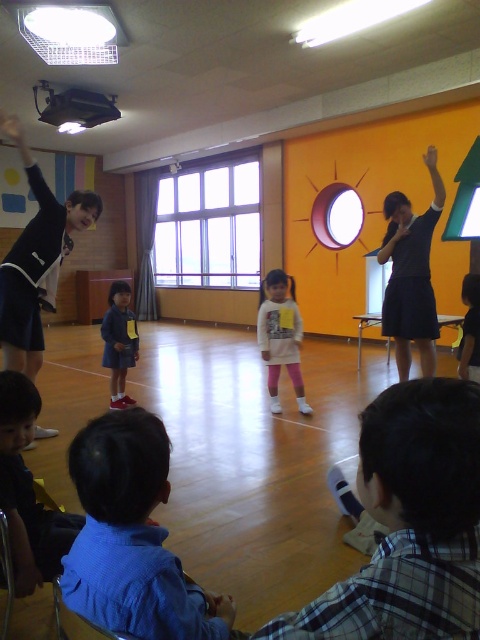
You are a teacher organizing a school event and need to decide which clothing item to use for a demonstration. The dark blue uniform at upper left and the dark blue skirt at center are available. Which one is larger in size?

The dark blue uniform at upper left is bigger than the dark blue skirt at center, so the teacher should choose the dark blue uniform at upper left for the demonstration.

You are a photographer trying to capture a candid shot of the dark blue skirt at center and the smooth skin hand at upper right. To ensure both are in focus, you need to know their vertical positions. Which object is positioned lower in the image?

The dark blue skirt at center is located below the smooth skin hand at upper right, so it is positioned lower in the image.

You are a photographer standing in the classroom and want to take a photo of both the point at coordinates point (x=116, y=282) and point (x=431, y=161). Which point should you focus on first to ensure both are in focus?

You should focus on point (x=116, y=282) first because it is closer to you than point (x=431, y=161). This ensures the closer point is in focus, and the farther point will also be within the depth of field.